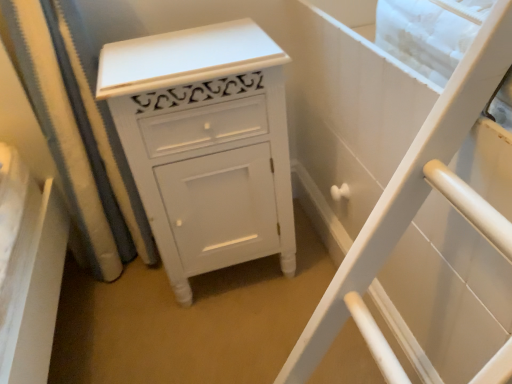
The height and width of the screenshot is (384, 512). I want to click on white painted wood cabinet at center, so click(206, 144).

The width and height of the screenshot is (512, 384). Describe the element at coordinates (206, 144) in the screenshot. I see `white painted wood cabinet at center` at that location.

The width and height of the screenshot is (512, 384). Describe the element at coordinates (80, 131) in the screenshot. I see `white fabric shower curtain at left` at that location.

At what (x,y) coordinates should I click in order to perform the action: click on white fabric shower curtain at left. Please return your answer as a coordinate pair (x, y). Image resolution: width=512 pixels, height=384 pixels. Looking at the image, I should click on (80, 131).

At what (x,y) coordinates should I click in order to perform the action: click on white painted wood cabinet at center. Please return your answer as a coordinate pair (x, y). The width and height of the screenshot is (512, 384). Looking at the image, I should click on (206, 144).

Which is more to the right, white fabric shower curtain at left or white painted wood cabinet at center?

Positioned to the right is white painted wood cabinet at center.

In the image, is white fabric shower curtain at left positioned in front of or behind white painted wood cabinet at center?

white fabric shower curtain at left is positioned farther from the viewer than white painted wood cabinet at center.

Is point (78, 50) less distant than point (277, 46)?

No, (78, 50) is behind (277, 46).

From the image's perspective, between white fabric shower curtain at left and white painted wood cabinet at center, who is located below?

From the image's view, white painted wood cabinet at center is below.

From a real-world perspective, which is physically below, white fabric shower curtain at left or white painted wood cabinet at center?

white painted wood cabinet at center.

Between white fabric shower curtain at left and white painted wood cabinet at center, which one has larger width?

With larger width is white painted wood cabinet at center.

In terms of height, does white fabric shower curtain at left look taller or shorter compared to white painted wood cabinet at center?

Clearly, white fabric shower curtain at left is taller compared to white painted wood cabinet at center.

Considering the sizes of white fabric shower curtain at left and white painted wood cabinet at center in the image, is white fabric shower curtain at left bigger or smaller than white painted wood cabinet at center?

Considering their sizes, white fabric shower curtain at left takes up less space than white painted wood cabinet at center.

Is white fabric shower curtain at left positioned beyond the bounds of white painted wood cabinet at center?

Yes, white fabric shower curtain at left is located beyond the bounds of white painted wood cabinet at center.

Consider the image. Are white fabric shower curtain at left and white painted wood cabinet at center far apart?

No, white fabric shower curtain at left is not far from white painted wood cabinet at center.

Is white fabric shower curtain at left oriented towards white painted wood cabinet at center?

Yes, white fabric shower curtain at left is facing white painted wood cabinet at center.

Based on the photo, how different are the orientations of white fabric shower curtain at left and white painted wood cabinet at center in degrees?

They differ by 1.68 degrees in their facing directions.

Measure the distance between white fabric shower curtain at left and white painted wood cabinet at center.

white fabric shower curtain at left is 11.01 inches away from white painted wood cabinet at center.

The height and width of the screenshot is (384, 512). I want to click on chest of drawers in front of the white fabric shower curtain at left, so pos(206,144).

Which object is positioned more to the right, white painted wood cabinet at center or white fabric shower curtain at left?

white painted wood cabinet at center is more to the right.

Which object is more forward, white painted wood cabinet at center or white fabric shower curtain at left?

Positioned in front is white painted wood cabinet at center.

Which point is more forward, (111, 52) or (104, 146)?

The point (111, 52) is in front.

Based on the photo, from the image's perspective, between white painted wood cabinet at center and white fabric shower curtain at left, which one is located above?

white fabric shower curtain at left, from the image's perspective.

From a real-world perspective, between white painted wood cabinet at center and white fabric shower curtain at left, who is vertically lower?

From a 3D spatial view, white painted wood cabinet at center is below.

Can you confirm if white painted wood cabinet at center is thinner than white fabric shower curtain at left?

No.

Is white painted wood cabinet at center taller than white fabric shower curtain at left?

No, white painted wood cabinet at center is not taller than white fabric shower curtain at left.

Between white painted wood cabinet at center and white fabric shower curtain at left, which one has larger size?

white painted wood cabinet at center is bigger.

Is white painted wood cabinet at center inside or outside of white fabric shower curtain at left?

white painted wood cabinet at center lies outside white fabric shower curtain at left.

Is white painted wood cabinet at center far away from white fabric shower curtain at left?

No, white painted wood cabinet at center is not far away from white fabric shower curtain at left.

Is white painted wood cabinet at center facing towards white fabric shower curtain at left?

No.

How many degrees apart are the facing directions of white painted wood cabinet at center and white fabric shower curtain at left?

1.68 degrees separate the facing orientations of white painted wood cabinet at center and white fabric shower curtain at left.

Consider the image. How distant is white painted wood cabinet at center from white fabric shower curtain at left?

A distance of 11.01 inches exists between white painted wood cabinet at center and white fabric shower curtain at left.

Where is `chest of drawers on the right of white fabric shower curtain at left`? The width and height of the screenshot is (512, 384). chest of drawers on the right of white fabric shower curtain at left is located at coordinates (206, 144).

At what (x,y) coordinates should I click in order to perform the action: click on shower curtain above the white painted wood cabinet at center (from a real-world perspective). Please return your answer as a coordinate pair (x, y). Looking at the image, I should click on (80, 131).

This screenshot has height=384, width=512. I want to click on shower curtain behind the white painted wood cabinet at center, so click(80, 131).